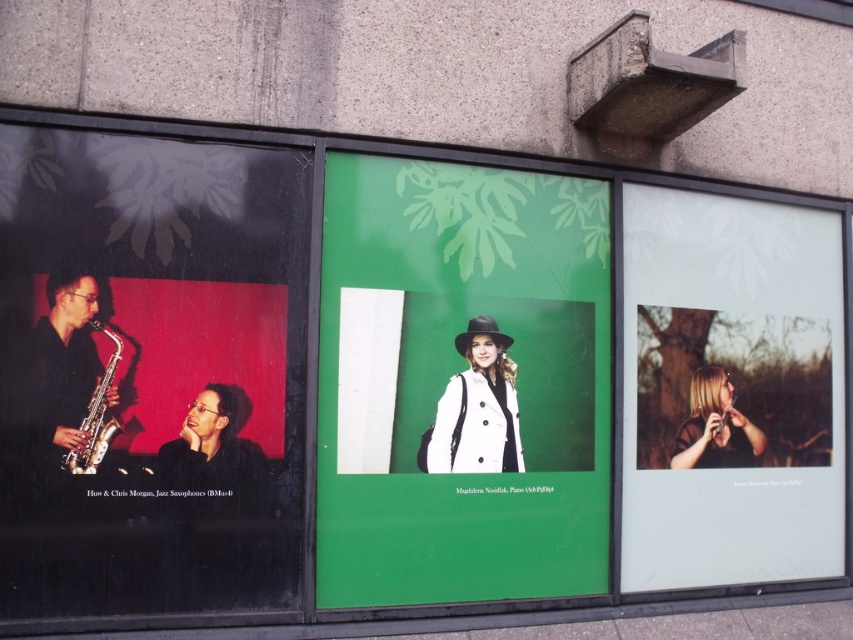
Is green matte poster at center smaller than matte black jacket at center?

No.

Where is `green matte poster at center`? The image size is (853, 640). green matte poster at center is located at coordinates (461, 384).

From the picture: Can you confirm if matte black saxophone at left is bigger than shiny silver saxophone at left?

Yes, matte black saxophone at left is bigger than shiny silver saxophone at left.

From the picture: Can you confirm if matte black saxophone at left is positioned above shiny silver saxophone at left?

Indeed, matte black saxophone at left is positioned over shiny silver saxophone at left.

Is point (114, 136) closer to viewer compared to point (56, 346)?

No.

Where is `matte black saxophone at left`? matte black saxophone at left is located at coordinates (151, 371).

Can you confirm if translucent glass portrait at right is wider than matte black jacket at center?

Indeed, translucent glass portrait at right has a greater width compared to matte black jacket at center.

Describe the element at coordinates (730, 390) in the screenshot. The height and width of the screenshot is (640, 853). I see `translucent glass portrait at right` at that location.

Between point (753, 440) and point (184, 465), which one is positioned in front?

Point (184, 465)

The height and width of the screenshot is (640, 853). I want to click on translucent glass portrait at right, so click(x=730, y=390).